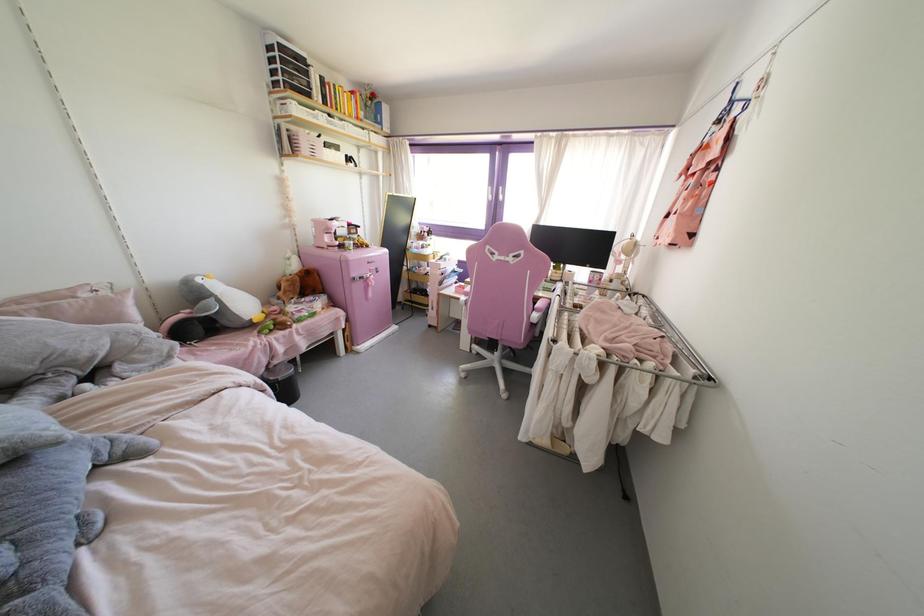
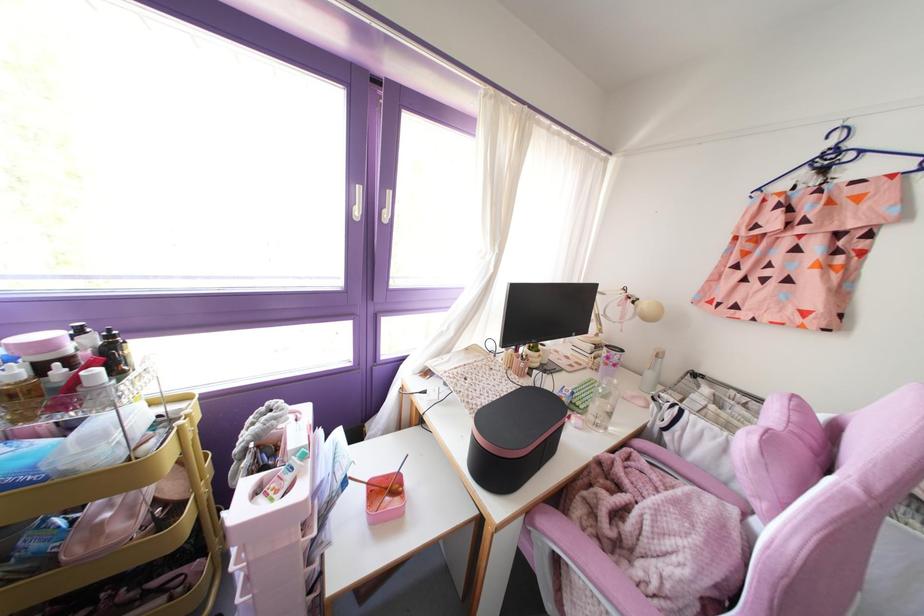
Where in the second image is the point corresponding to the point at 590,281 from the first image?

(614, 365)